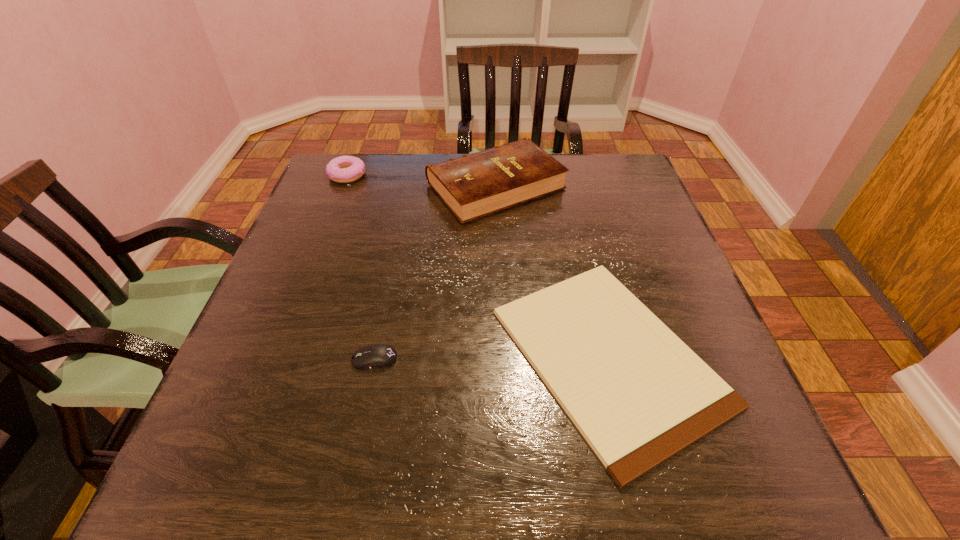
Locate an element on the screen. Image resolution: width=960 pixels, height=540 pixels. free spot between the shortest object and the second tallest object is located at coordinates (478, 266).

What are the coordinates of `free space between the doughnut and the computer equipment` in the screenshot? It's located at (361, 267).

Identify the location of vacant area that lies between the leftmost object and the second object from left to right. This screenshot has height=540, width=960. (361, 267).

At what (x,y) coordinates should I click in order to perform the action: click on empty location between the second object from left to right and the shortest object. Please return your answer as a coordinate pair (x, y). This screenshot has height=540, width=960. Looking at the image, I should click on (492, 357).

Image resolution: width=960 pixels, height=540 pixels. Find the location of `free space between the third tallest object and the third shortest object`. free space between the third tallest object and the third shortest object is located at coordinates (361, 267).

Select which object is the second closest to the third shortest object. Please provide its 2D coordinates. Your answer should be formatted as a tuple, i.e. [(x, y)], where the tuple contains the x and y coordinates of a point satisfying the conditions above.

[(637, 393)]

Locate which object ranks in proximity to the hardback book. Please provide its 2D coordinates. Your answer should be formatted as a tuple, i.e. [(x, y)], where the tuple contains the x and y coordinates of a point satisfying the conditions above.

[(637, 393)]

At what (x,y) coordinates should I click in order to perform the action: click on vacant area that satisfies the following two spatial constraints: 1. on the back side of the computer equipment; 2. on the left side of the clipboard. Please return your answer as a coordinate pair (x, y). The width and height of the screenshot is (960, 540). Looking at the image, I should click on (375, 356).

Locate an element on the screen. The width and height of the screenshot is (960, 540). vacant area in the image that satisfies the following two spatial constraints: 1. on the front side of the shortest object; 2. on the left side of the second tallest object is located at coordinates point(276,356).